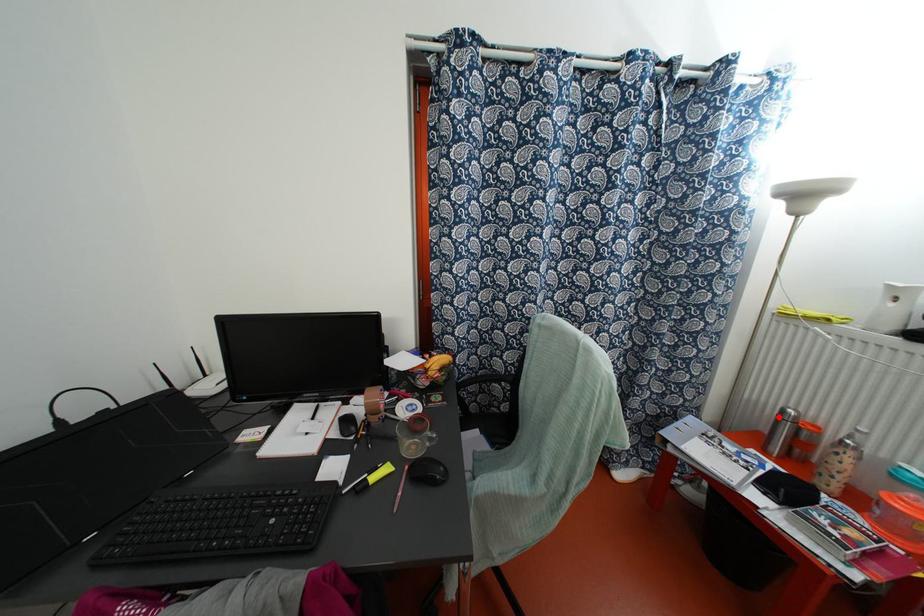
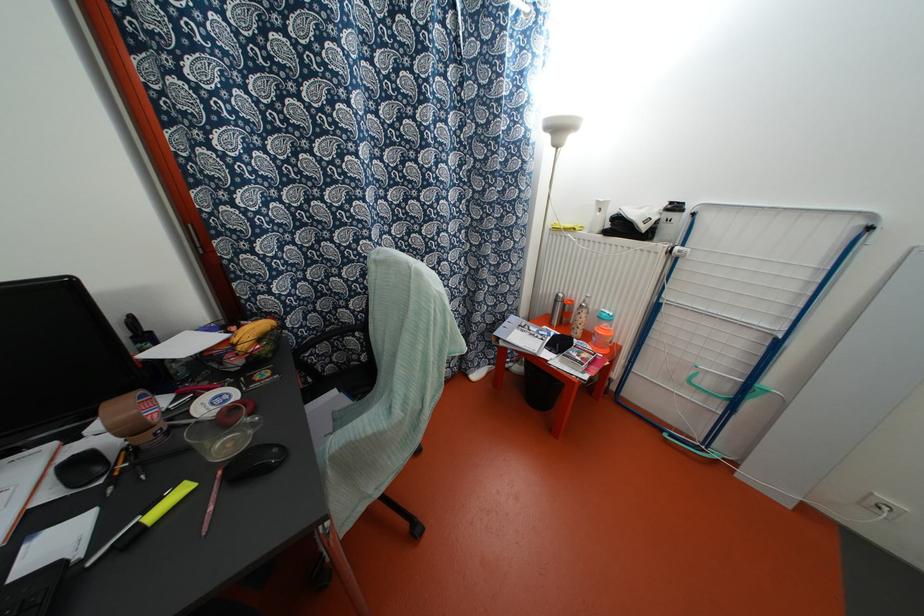
Where in the second image is the point corresponding to the highlighted location from the first image?

(554, 301)